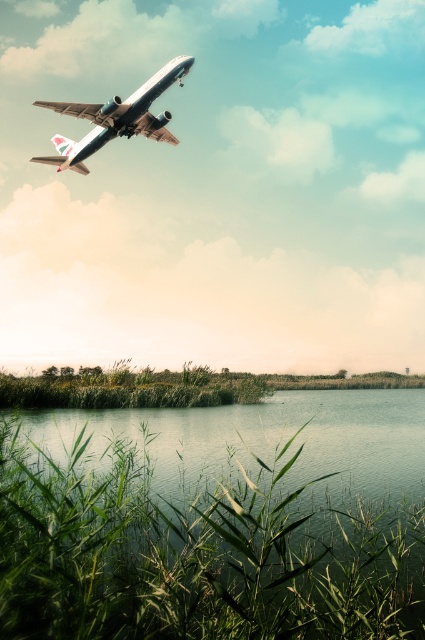
Question: Which of the following is the farthest from the observer?

Choices:
 (A) metallic silver airplane at upper left
 (B) green leafy reeds at lower center

Answer: (A)

Question: Does green leafy reeds at lower center come behind metallic silver airplane at upper left?

Choices:
 (A) no
 (B) yes

Answer: (A)

Question: Does green leafy reeds at lower center have a larger size compared to metallic silver airplane at upper left?

Choices:
 (A) no
 (B) yes

Answer: (A)

Question: Which point is farther from the camera taking this photo?

Choices:
 (A) (323, 604)
 (B) (127, 131)

Answer: (B)

Question: Is green leafy reeds at lower center above metallic silver airplane at upper left?

Choices:
 (A) yes
 (B) no

Answer: (B)